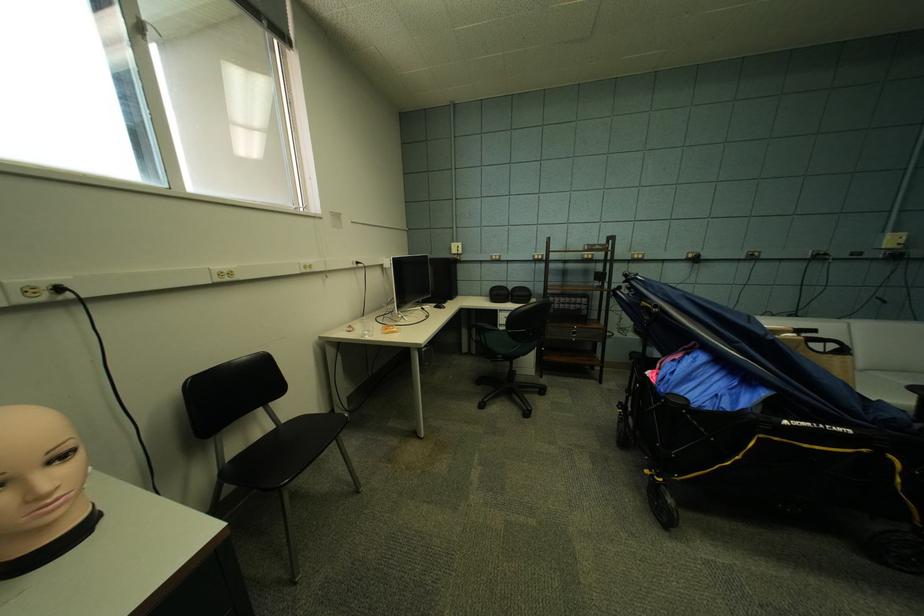
This screenshot has height=616, width=924. Describe the element at coordinates (579, 254) in the screenshot. I see `the wagon handle` at that location.